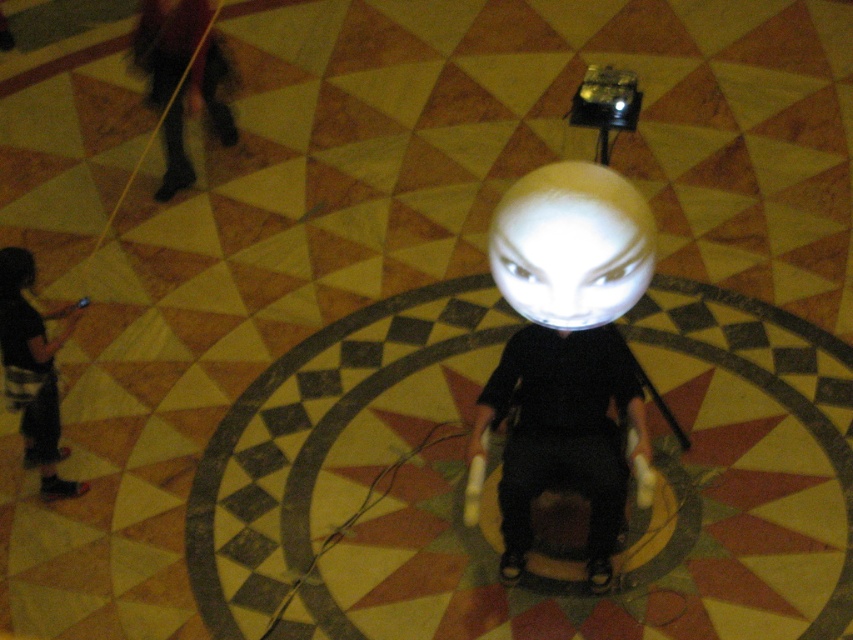
You are standing in the room and want to reach the white glossy sphere at center without moving your feet. Can you touch it with your outstretched hand?

The white glossy sphere at center is 11.56 feet away from you, which is beyond the typical human arm reach. You cannot touch it with your outstretched hand.

You are an interior designer assessing the layout of this room. You need to place a new shelf that must be taller than the black matte hair at lower left. Can the white glossy sphere at center serve as a reference for the minimum height requirement?

The white glossy sphere at center has a greater height compared to black matte hair at lower left, so it can serve as a reference for the minimum height requirement since it meets the requirement of being taller than the black matte hair at lower left.